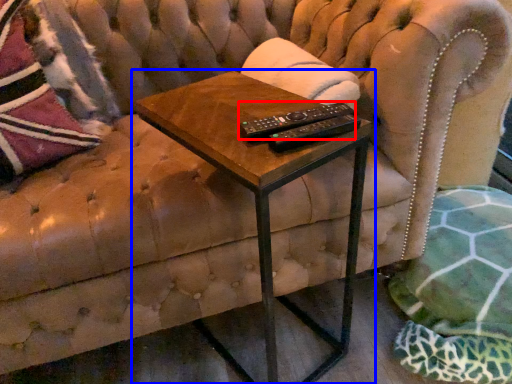
Question: Among these objects, which one is nearest to the camera, control (highlighted by a red box) or table (highlighted by a blue box)?

Choices:
 (A) control
 (B) table

Answer: (B)